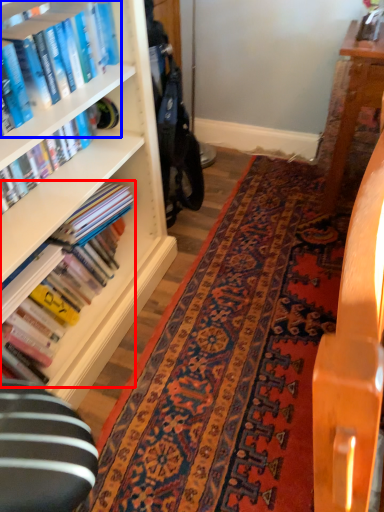
Question: Which object is further to the camera taking this photo, book (highlighted by a red box) or book (highlighted by a blue box)?

Choices:
 (A) book
 (B) book

Answer: (A)